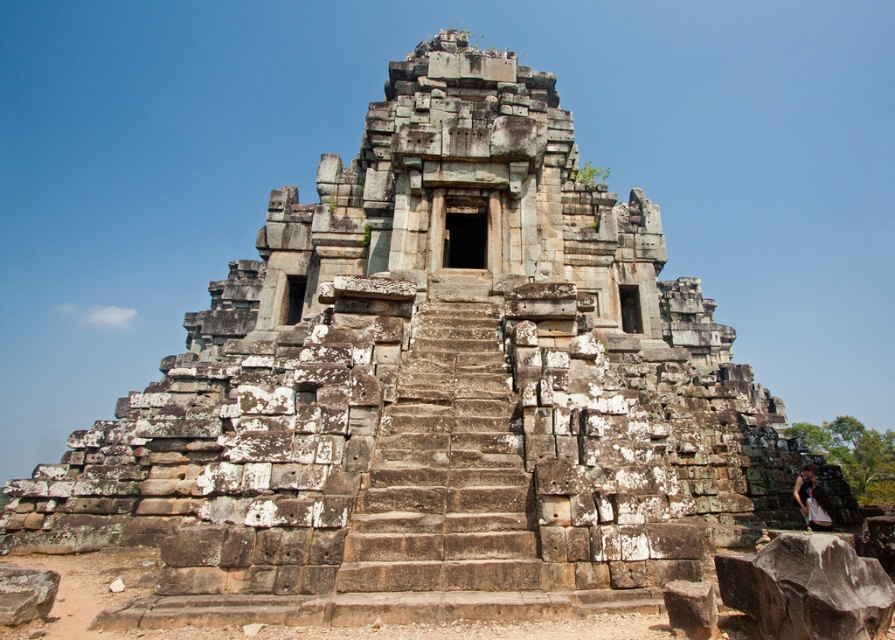
You are standing at the base of the ancient stone structure and want to reach the entrance at the top. There is a white cotton dress at lower right that might block your path. Can you climb the brown stone stairs at center without stepping on the dress?

The brown stone stairs at center are closer to the viewer than the white cotton dress at lower right, so the dress is behind the stairs. Therefore, you can climb the brown stone stairs at center without stepping on the dress.

From the picture: You are standing at the base of the ancient stone structure and want to reach the entrance at the top. According to the coordinates provided, where exactly are the brown stone stairs at center located in relation to your current position?

The brown stone stairs at center are located at coordinates point (448, 468), which is to the right and slightly above your current position at the base.